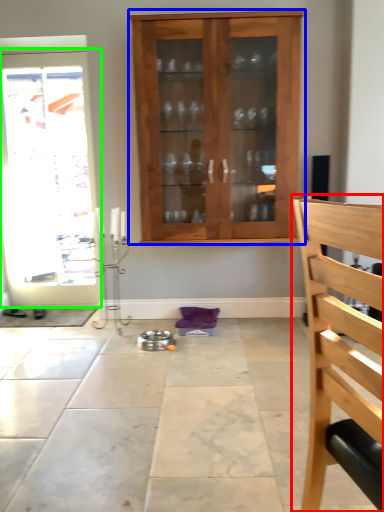
Question: Based on their relative distances, which object is nearer to chair (highlighted by a red box)? Choose from cabinetry (highlighted by a blue box) and door (highlighted by a green box).

Choices:
 (A) cabinetry
 (B) door

Answer: (A)